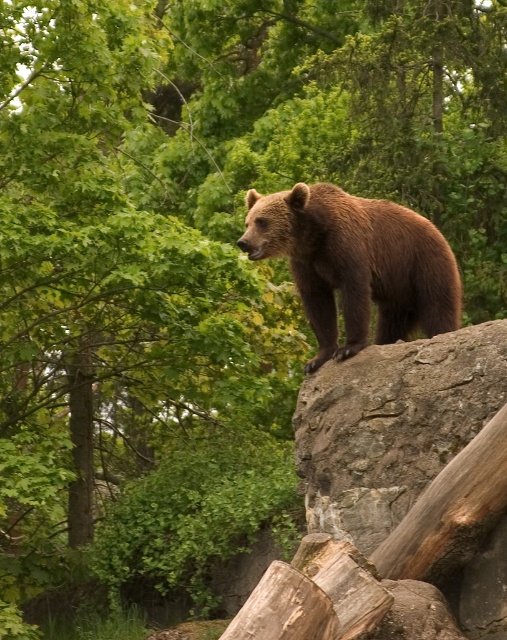
You are a photographer trying to capture the brown furry bear at center and the rough textured rock at upper center in the same frame. Based on their positions, can you determine which object is closer to the camera?

The rough textured rock at upper center is located below the brown furry bear at center, which means the brown furry bear at center is closer to the camera than the rock.

You are a wildlife photographer aiming to capture a closeup of the rough textured rock at upper center where the brown bear is standing. Your camera has a maximum zoom range of 10 meters. Can you get a clear closeup shot from your current position?

The rough textured rock at upper center is 12.24 meters away from the viewer. Since your camera can only zoom up to 10 meters, you cannot get a clear closeup shot from your current position.